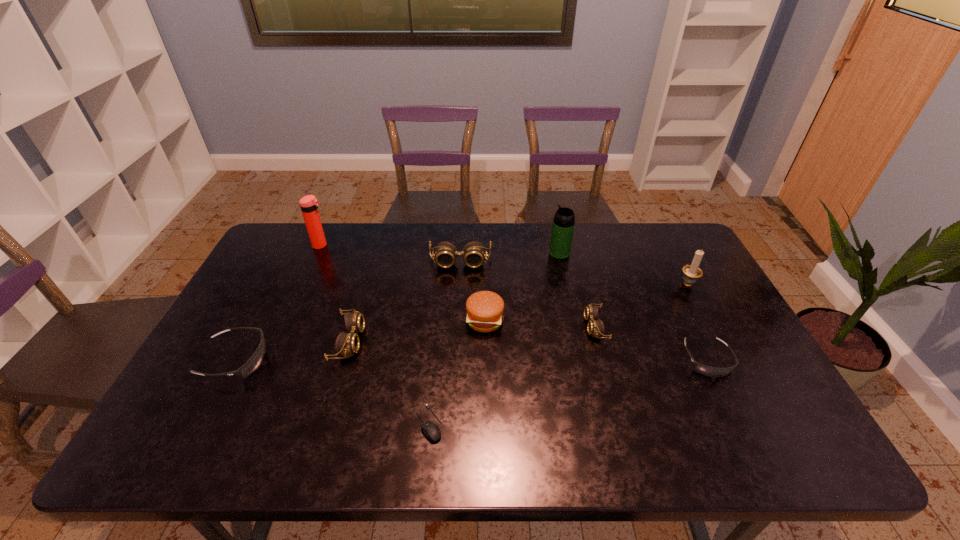
The width and height of the screenshot is (960, 540). In the image, there is a desktop. Identify the location of vacant space at the near edge. (689, 449).

Where is `blank area at the left edge`? blank area at the left edge is located at coordinates click(x=222, y=390).

Locate an element on the screen. vacant space at the right edge of the desktop is located at coordinates (x=748, y=340).

Image resolution: width=960 pixels, height=540 pixels. Identify the location of vacant space at the far left corner. (295, 241).

Where is `free spot at the far right corner of the desktop`? This screenshot has width=960, height=540. free spot at the far right corner of the desktop is located at coordinates point(665,231).

Locate an element on the screen. The height and width of the screenshot is (540, 960). free area in between the second shortest object and the bigger black goggles is located at coordinates click(471, 360).

At what (x,y) coordinates should I click in order to perform the action: click on free space between the candle_holder and the green thermos bottle. Please return your answer as a coordinate pair (x, y). This screenshot has height=540, width=960. Looking at the image, I should click on (x=623, y=268).

At what (x,y) coordinates should I click in order to perform the action: click on vacant space that is in between the second goggles from left to right and the bigger black goggles. Please return your answer as a coordinate pair (x, y). This screenshot has width=960, height=540. Looking at the image, I should click on click(293, 350).

Identify the location of free space between the seventh nearest object and the left black goggles. (461, 321).

Identify the location of free space between the third tallest object and the bigger black goggles. (461, 321).